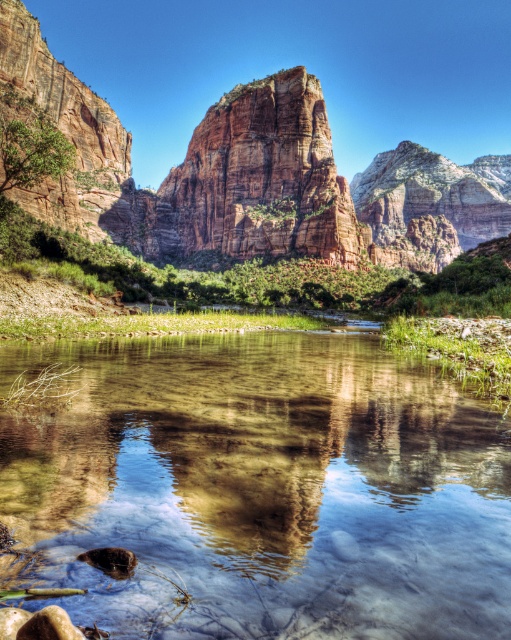
Between point (351, 250) and point (172, 186), which one is positioned in front?

Positioned in front is point (351, 250).

Is rustic sandstone mountain at center wider than reddish-brown sandstone cliff at center?

Yes.

Is point (283, 145) less distant than point (252, 228)?

No.

The width and height of the screenshot is (511, 640). Identify the location of rustic sandstone mountain at center. (250, 177).

Can you confirm if clear water at center is thinner than reddish-brown sandstone cliff at center?

Yes.

Who is lower down, clear water at center or reddish-brown sandstone cliff at center?

clear water at center

Who is more forward, (336, 588) or (310, 240)?

Positioned in front is point (336, 588).

Where is `clear water at center`? Image resolution: width=511 pixels, height=640 pixels. clear water at center is located at coordinates (262, 488).

Is clear water at center bigger than rustic sandstone mountain at center?

Actually, clear water at center might be smaller than rustic sandstone mountain at center.

Between clear water at center and rustic sandstone mountain at center, which one is positioned higher?

rustic sandstone mountain at center is above.

Identify the location of clear water at center. The height and width of the screenshot is (640, 511). (262, 488).